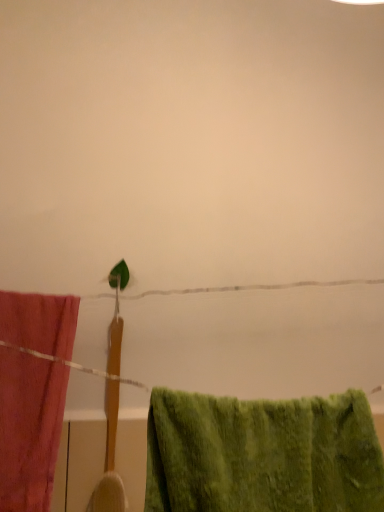
This screenshot has height=512, width=384. Describe the element at coordinates (262, 454) in the screenshot. I see `green fuzzy towel at lower right, the first towel from the right` at that location.

The image size is (384, 512). What are the coordinates of `green fuzzy towel at lower right, positioned as the 2th towel in left-to-right order` in the screenshot? It's located at (262, 454).

What do you see at coordinates (29, 429) in the screenshot? This screenshot has width=384, height=512. I see `matte pink towel at left, the 1th towel in the back-to-front sequence` at bounding box center [29, 429].

Locate an element on the screen. Image resolution: width=384 pixels, height=512 pixels. matte pink towel at left, marked as the 2th towel in a right-to-left arrangement is located at coordinates (29, 429).

Locate an element on the screen. Image resolution: width=384 pixels, height=512 pixels. green fuzzy towel at lower right, which is the second towel from back to front is located at coordinates (262, 454).

Considering the relative positions of matte pink towel at left, acting as the 2th towel starting from the front, and green fuzzy towel at lower right, which is the second towel from back to front, in the image provided, is matte pink towel at left, acting as the 2th towel starting from the front, to the right of green fuzzy towel at lower right, which is the second towel from back to front, from the viewer's perspective?

No, matte pink towel at left, acting as the 2th towel starting from the front, is not to the right of green fuzzy towel at lower right, which is the second towel from back to front.

Consider the image. In the image, is matte pink towel at left, which is the first towel in left-to-right order, positioned in front of or behind green fuzzy towel at lower right, the first towel from the right?

matte pink towel at left, which is the first towel in left-to-right order, is behind green fuzzy towel at lower right, the first towel from the right.

Considering the positions of point (25, 446) and point (198, 424), is point (25, 446) closer or farther from the camera than point (198, 424)?

Point (25, 446) is positioned farther from the camera compared to point (198, 424).

From the image's perspective, which object appears higher, matte pink towel at left, marked as the 2th towel in a right-to-left arrangement, or green fuzzy towel at lower right, which is the second towel from back to front?

matte pink towel at left, marked as the 2th towel in a right-to-left arrangement, from the image's perspective.

From a real-world perspective, between matte pink towel at left, which is the first towel in left-to-right order, and green fuzzy towel at lower right, positioned as the 2th towel in left-to-right order, who is vertically lower?

green fuzzy towel at lower right, positioned as the 2th towel in left-to-right order, is physically lower.

Between matte pink towel at left, acting as the 2th towel starting from the front, and green fuzzy towel at lower right, which is the second towel from back to front, which one has larger width?

Wider between the two is green fuzzy towel at lower right, which is the second towel from back to front.

Which of these two, matte pink towel at left, acting as the 2th towel starting from the front, or green fuzzy towel at lower right, which ranks as the first towel in front-to-back order, stands taller?

Standing taller between the two is matte pink towel at left, acting as the 2th towel starting from the front.

Who is bigger, matte pink towel at left, the 1th towel in the back-to-front sequence, or green fuzzy towel at lower right, which ranks as the first towel in front-to-back order?

Bigger between the two is green fuzzy towel at lower right, which ranks as the first towel in front-to-back order.

Is matte pink towel at left, which is the first towel in left-to-right order, outside of green fuzzy towel at lower right, which ranks as the first towel in front-to-back order?

Indeed, matte pink towel at left, which is the first towel in left-to-right order, is completely outside green fuzzy towel at lower right, which ranks as the first towel in front-to-back order.

From the picture: Is matte pink towel at left, which is the first towel in left-to-right order, next to green fuzzy towel at lower right, positioned as the 2th towel in left-to-right order, and touching it?

No, matte pink towel at left, which is the first towel in left-to-right order, is not next to green fuzzy towel at lower right, positioned as the 2th towel in left-to-right order.

Is matte pink towel at left, which is the first towel in left-to-right order, facing towards green fuzzy towel at lower right, which ranks as the first towel in front-to-back order?

No, matte pink towel at left, which is the first towel in left-to-right order, is not turned towards green fuzzy towel at lower right, which ranks as the first towel in front-to-back order.

Can you tell me how much matte pink towel at left, marked as the 2th towel in a right-to-left arrangement, and green fuzzy towel at lower right, the first towel from the right, differ in facing direction?

The facing directions of matte pink towel at left, marked as the 2th towel in a right-to-left arrangement, and green fuzzy towel at lower right, the first towel from the right, are 0.00235 degrees apart.

You are a GUI agent. You are given a task and a screenshot of the screen. Output one action in this format:
    pyautogui.click(x=<x>, y=<y>)
    Task: Click on the towel that is on the left side of green fuzzy towel at lower right, the first towel from the right
    
    Given the screenshot: What is the action you would take?
    point(29,429)

Considering the relative positions of green fuzzy towel at lower right, the first towel from the right, and matte pink towel at left, marked as the 2th towel in a right-to-left arrangement, in the image provided, is green fuzzy towel at lower right, the first towel from the right, to the left or to the right of matte pink towel at left, marked as the 2th towel in a right-to-left arrangement,?

Based on their positions, green fuzzy towel at lower right, the first towel from the right, is located to the right of matte pink towel at left, marked as the 2th towel in a right-to-left arrangement.

Is green fuzzy towel at lower right, which is the second towel from back to front, further to camera compared to matte pink towel at left, marked as the 2th towel in a right-to-left arrangement?

No, green fuzzy towel at lower right, which is the second towel from back to front, is closer to the viewer.

Is point (265, 441) positioned before point (2, 453)?

That is True.

From the image's perspective, would you say green fuzzy towel at lower right, which is the second towel from back to front, is shown under matte pink towel at left, the 1th towel in the back-to-front sequence?

Correct, green fuzzy towel at lower right, which is the second towel from back to front, appears lower than matte pink towel at left, the 1th towel in the back-to-front sequence, in the image.

From a real-world perspective, is green fuzzy towel at lower right, which ranks as the first towel in front-to-back order, above or below matte pink towel at left, marked as the 2th towel in a right-to-left arrangement?

From a real-world perspective, green fuzzy towel at lower right, which ranks as the first towel in front-to-back order, is physically below matte pink towel at left, marked as the 2th towel in a right-to-left arrangement.

Which object is thinner, green fuzzy towel at lower right, the first towel from the right, or matte pink towel at left, marked as the 2th towel in a right-to-left arrangement?

matte pink towel at left, marked as the 2th towel in a right-to-left arrangement, is thinner.

Does green fuzzy towel at lower right, which ranks as the first towel in front-to-back order, have a lesser height compared to matte pink towel at left, the 1th towel in the back-to-front sequence?

Yes, green fuzzy towel at lower right, which ranks as the first towel in front-to-back order, is shorter than matte pink towel at left, the 1th towel in the back-to-front sequence.

Based on the photo, looking at the image, does green fuzzy towel at lower right, which is the second towel from back to front, seem bigger or smaller compared to matte pink towel at left, which is the first towel in left-to-right order?

Considering their sizes, green fuzzy towel at lower right, which is the second towel from back to front, takes up more space than matte pink towel at left, which is the first towel in left-to-right order.

Would you say matte pink towel at left, marked as the 2th towel in a right-to-left arrangement, is part of green fuzzy towel at lower right, which ranks as the first towel in front-to-back order,'s contents?

No, green fuzzy towel at lower right, which ranks as the first towel in front-to-back order, does not contain matte pink towel at left, marked as the 2th towel in a right-to-left arrangement.

Is green fuzzy towel at lower right, positioned as the 2th towel in left-to-right order, placed right next to matte pink towel at left, which is the first towel in left-to-right order?

No, green fuzzy towel at lower right, positioned as the 2th towel in left-to-right order, is not next to matte pink towel at left, which is the first towel in left-to-right order.

Is green fuzzy towel at lower right, the first towel from the right, oriented away from matte pink towel at left, the 1th towel in the back-to-front sequence?

No, green fuzzy towel at lower right, the first towel from the right, is not facing away from matte pink towel at left, the 1th towel in the back-to-front sequence.

How different are the orientations of green fuzzy towel at lower right, positioned as the 2th towel in left-to-right order, and matte pink towel at left, marked as the 2th towel in a right-to-left arrangement, in degrees?

green fuzzy towel at lower right, positioned as the 2th towel in left-to-right order, and matte pink towel at left, marked as the 2th towel in a right-to-left arrangement, are facing 0.00235 degrees away from each other.

Image resolution: width=384 pixels, height=512 pixels. What are the coordinates of `towel below the matte pink towel at left, acting as the 2th towel starting from the front (from a real-world perspective)` in the screenshot? It's located at (262, 454).

Where is `towel lying above the green fuzzy towel at lower right, positioned as the 2th towel in left-to-right order (from the image's perspective)`? Image resolution: width=384 pixels, height=512 pixels. towel lying above the green fuzzy towel at lower right, positioned as the 2th towel in left-to-right order (from the image's perspective) is located at coordinates (29, 429).

Where is `towel on the right of the matte pink towel at left, the 1th towel in the back-to-front sequence`? The width and height of the screenshot is (384, 512). towel on the right of the matte pink towel at left, the 1th towel in the back-to-front sequence is located at coordinates (262, 454).